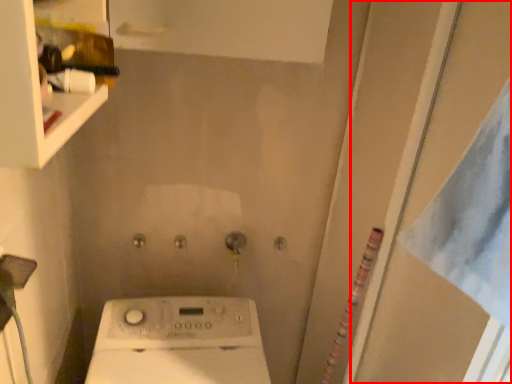
Question: Where is screen door (annotated by the red box) located in relation to shelf in the image?

Choices:
 (A) left
 (B) right

Answer: (B)